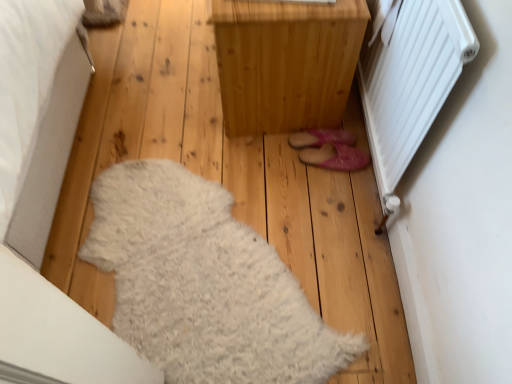
Question: Is natural wood cabinet at center in front of or behind pink fuzzy slippers at center in the image?

Choices:
 (A) behind
 (B) front

Answer: (B)

Question: Considering the positions of natural wood cabinet at center and pink fuzzy slippers at center in the image, is natural wood cabinet at center taller or shorter than pink fuzzy slippers at center?

Choices:
 (A) short
 (B) tall

Answer: (B)

Question: Which object is positioned closest to the white fluffy rug at lower left?

Choices:
 (A) natural wood cabinet at center
 (B) pink fuzzy slippers at center

Answer: (A)

Question: Which object is the farthest from the white fluffy rug at lower left?

Choices:
 (A) pink fuzzy slippers at center
 (B) natural wood cabinet at center

Answer: (A)